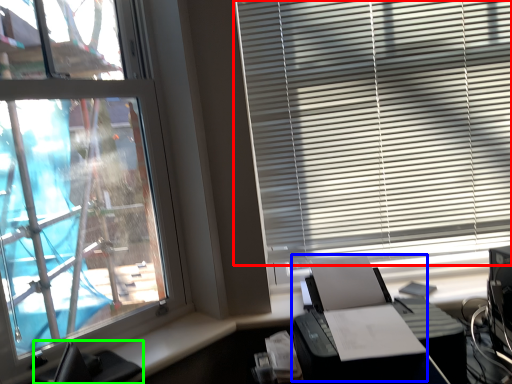
Question: Which is farther away from window blind (highlighted by a red box)? printer (highlighted by a blue box) or computer chair (highlighted by a green box)?

Choices:
 (A) printer
 (B) computer chair

Answer: (B)